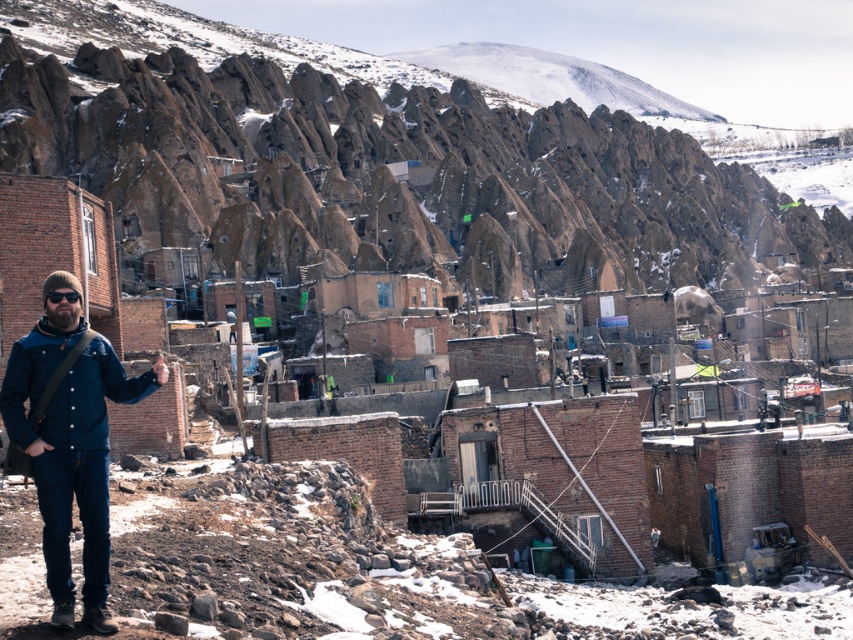
You are a hiker trying to reach the summit of the brown rocky mountain at upper center. You are currently standing at the location of the blue denim jacket at lower left. Which direction should you head to ascend the mountain?

The brown rocky mountain at upper center is positioned over the blue denim jacket at lower left, so you should head upwards from the blue denim jacket at lower left towards the brown rocky mountain at upper center to ascend the mountain.

You are a hiker standing at the base of the brown rocky mountain at upper center and see the blue denim jacket at lower left. Which object is closer to your current position?

The blue denim jacket at lower left is closer to your current position because it is located at the lower left, which is typically the foreground in such images, whereas the brown rocky mountain at upper center is positioned higher up, indicating it is further away.